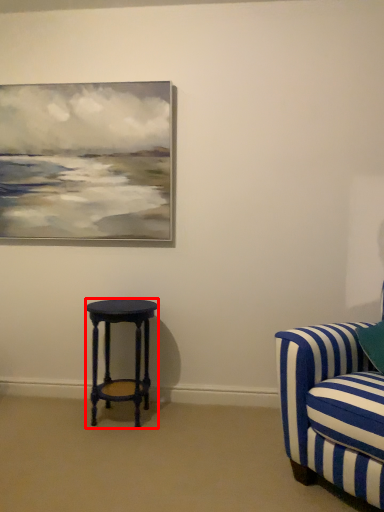
Question: From the image's perspective, what is the correct spatial positioning of stool (annotated by the red box) in reference to studio couch?

Choices:
 (A) below
 (B) above

Answer: (A)